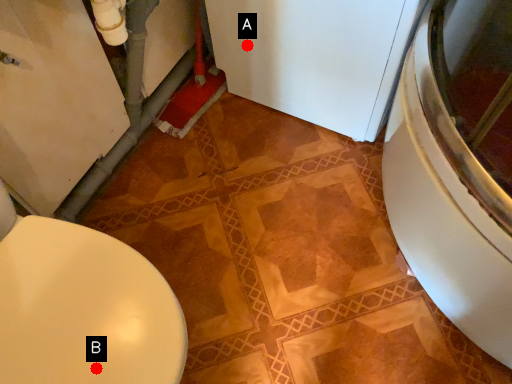
Question: Two points are circled on the image, labeled by A and B beside each circle. Among these points, which one is nearest to the camera?

Choices:
 (A) A is closer
 (B) B is closer

Answer: (B)